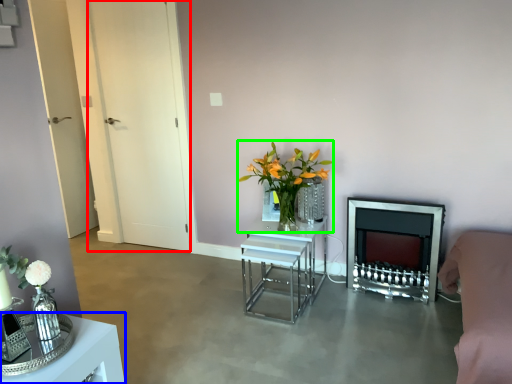
Question: Based on their relative distances, which object is nearer to glass door (highlighted by a red box)? Choose from table (highlighted by a blue box) and floral arrangement (highlighted by a green box).

Choices:
 (A) table
 (B) floral arrangement

Answer: (B)